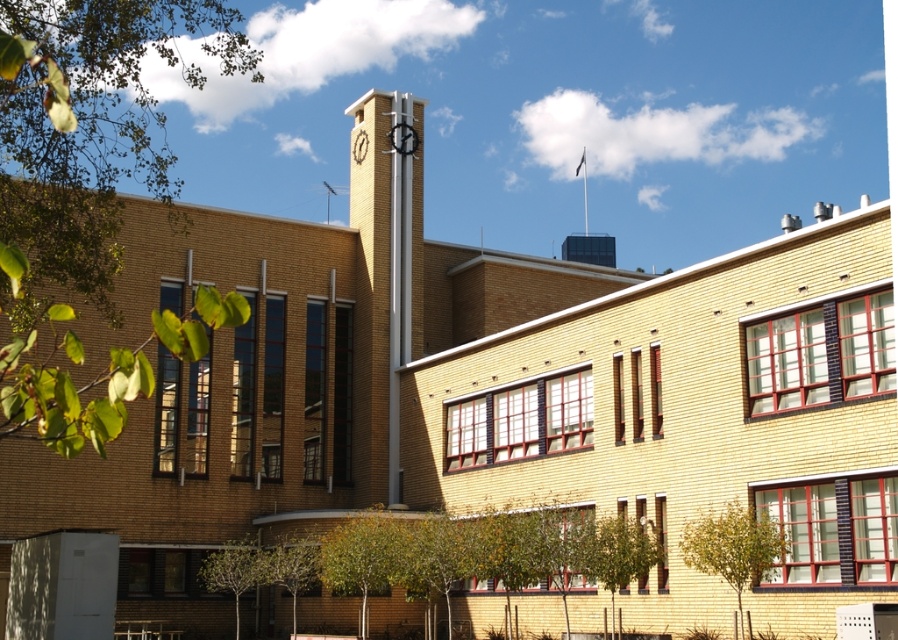
You are an architect reviewing a building design. You notice two clocks on the central tower of the building. Which one is bigger between the black glossy clock at center and the white metallic clock at center?

The black glossy clock at center is larger in size than the white metallic clock at center.

You are an architect reviewing the building plans. According to the image, where is the white metallic clock at center positioned relative to the brick clock tower at center?

The white metallic clock at center is above the brick clock tower at center, as the brick clock tower at center is below the white metallic clock at center.

You are standing in front of the modernist building and want to take a photo. There are two points marked on the building at coordinates point (407,147) and point (359,163). Which point appears closer to you when looking at the building?

Point (407,147) is closer to the camera than point (359,163), so it appears closer to you when looking at the building.